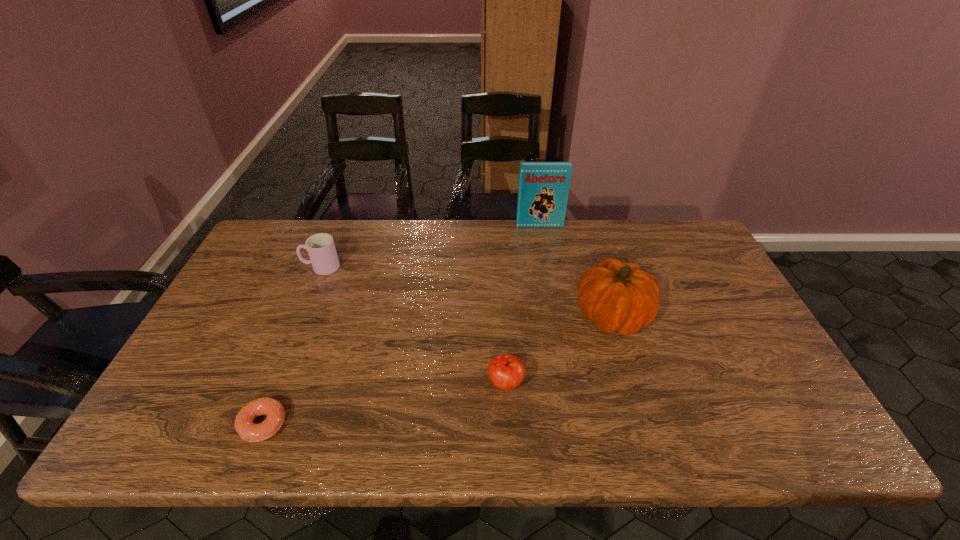
The width and height of the screenshot is (960, 540). In the image, there is a desktop. Identify the location of vacant region at the left edge. (223, 309).

The width and height of the screenshot is (960, 540). I want to click on vacant space at the right edge of the desktop, so click(x=723, y=320).

In order to click on vacant region at the far left corner of the desktop in this screenshot , I will do `click(305, 225)`.

You are a GUI agent. You are given a task and a screenshot of the screen. Output one action in this format:
    pyautogui.click(x=<x>, y=<y>)
    Task: Click on the free location at the near left corner
    The width and height of the screenshot is (960, 540).
    Given the screenshot: What is the action you would take?
    pyautogui.click(x=160, y=420)

Where is `free space at the far right corner of the desktop`? The width and height of the screenshot is (960, 540). free space at the far right corner of the desktop is located at coordinates (659, 241).

Locate an element on the screen. Image resolution: width=960 pixels, height=540 pixels. free space at the near right corner is located at coordinates (742, 425).

You are a GUI agent. You are given a task and a screenshot of the screen. Output one action in this format:
    pyautogui.click(x=<x>, y=<y>)
    Task: Click on the unoccupied position between the cup and the nearest object
    The width and height of the screenshot is (960, 540).
    Given the screenshot: What is the action you would take?
    pyautogui.click(x=292, y=346)

In order to click on vacant space in between the cup and the second nearest object in this screenshot , I will do `click(413, 325)`.

I want to click on empty space between the fourth nearest object and the pumpkin, so click(467, 291).

Where is `free point between the apple and the fourth shortest object`? free point between the apple and the fourth shortest object is located at coordinates (559, 349).